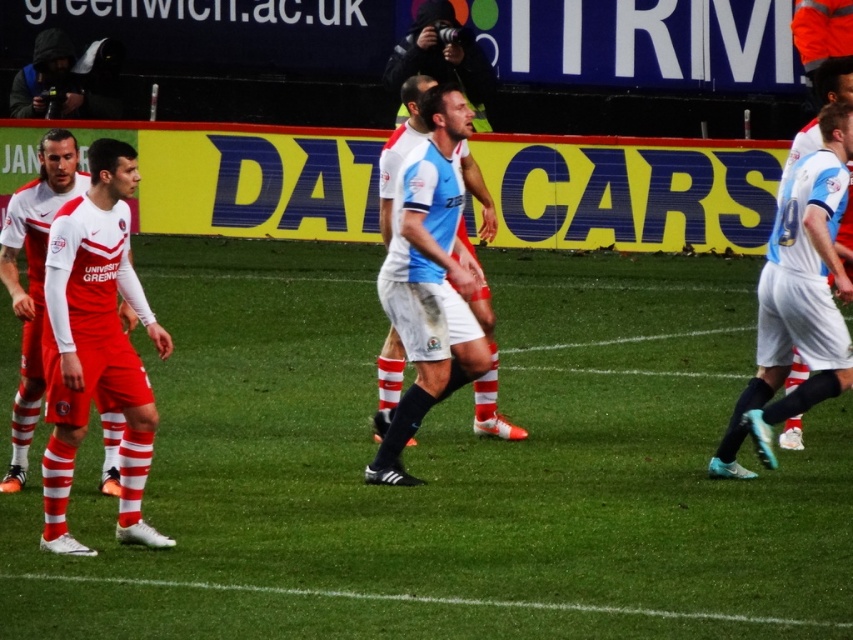
The image size is (853, 640). Describe the element at coordinates (798, 298) in the screenshot. I see `light blue jersey at center` at that location.

Can you confirm if light blue jersey at center is smaller than white matte soccer player at center?

No.

Which is in front, point (778, 333) or point (393, 346)?

Point (778, 333) is more forward.

The height and width of the screenshot is (640, 853). What are the coordinates of `light blue jersey at center` in the screenshot? It's located at (798, 298).

Between point (51, 435) and point (389, 156), which one is positioned behind?

The point (389, 156) is behind.

Can you confirm if matte red uniform at left is positioned to the left of white matte soccer player at center?

Indeed, matte red uniform at left is positioned on the left side of white matte soccer player at center.

Locate an element on the screen. matte red uniform at left is located at coordinates (96, 346).

Locate an element on the screen. This screenshot has width=853, height=640. matte red uniform at left is located at coordinates (96, 346).

Does matte red uniform at left have a greater height compared to light blue jersey at center?

Incorrect, matte red uniform at left's height is not larger of light blue jersey at center's.

Can you confirm if matte red uniform at left is positioned to the left of light blue jersey at center?

Yes, matte red uniform at left is to the left of light blue jersey at center.

Who is more forward, (122, 456) or (836, 310)?

Positioned in front is point (122, 456).

In order to click on matte red uniform at left in this screenshot , I will do `click(96, 346)`.